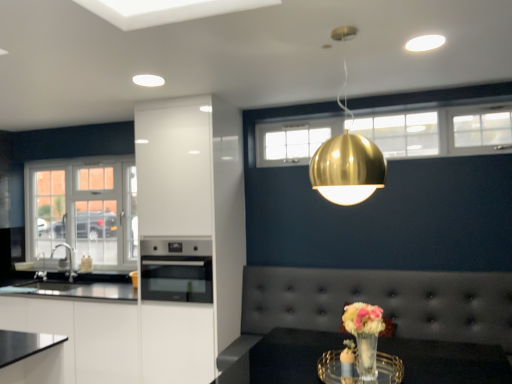
Locate an element on the screen. This screenshot has height=384, width=512. free point above gold metallic sphere at upper center (from a real-world perspective) is located at coordinates (335, 34).